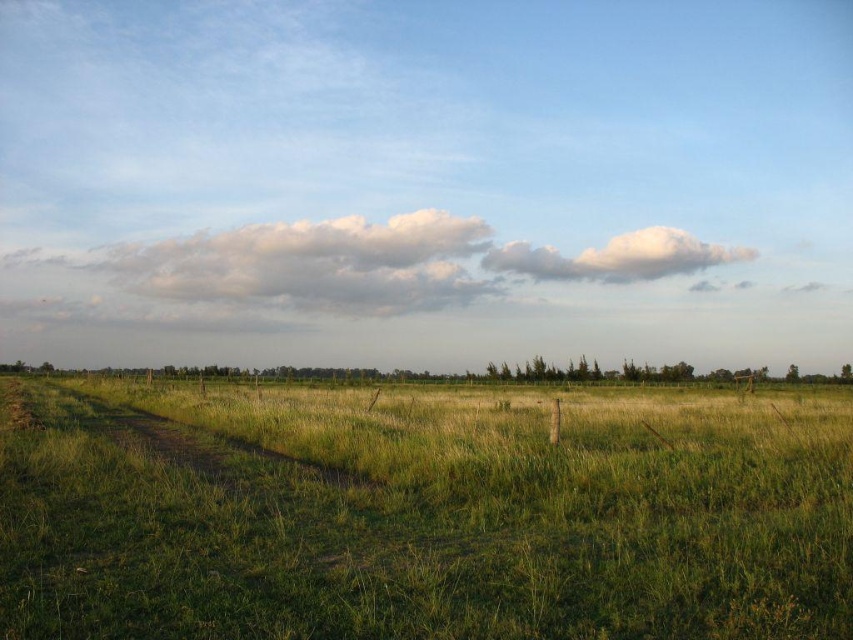
Question: Which object is closer to the camera taking this photo?

Choices:
 (A) green grass at center
 (B) white fluffy cloud at upper center

Answer: (A)

Question: Is green grass at center further to camera compared to white fluffy cloud at upper center?

Choices:
 (A) no
 (B) yes

Answer: (A)

Question: Can you confirm if green grass at center is wider than white fluffy cloud at upper center?

Choices:
 (A) yes
 (B) no

Answer: (A)

Question: Which point is farther to the camera?

Choices:
 (A) (786, 604)
 (B) (577, 273)

Answer: (B)

Question: Which of the following is the farthest from the observer?

Choices:
 (A) white fluffy cloud at upper center
 (B) green grass at center

Answer: (A)

Question: Is green grass at center below white fluffy cloud at upper center?

Choices:
 (A) yes
 (B) no

Answer: (A)